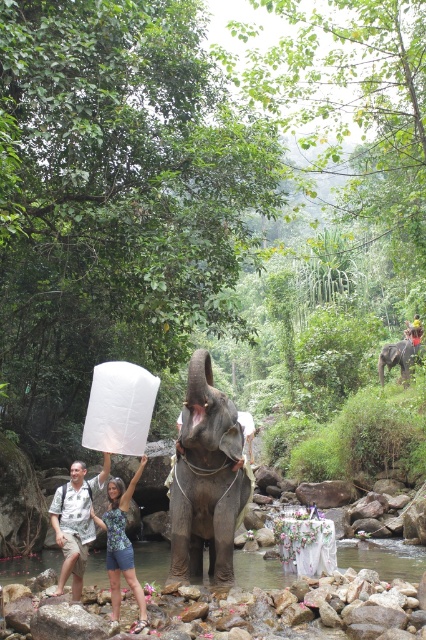
Question: Can you confirm if gray textured elephant at center is positioned above blue printed tank top at center?

Choices:
 (A) no
 (B) yes

Answer: (B)

Question: Which is nearer to the gray matte elephant at center?

Choices:
 (A) gray textured elephant at center
 (B) blue printed tank top at center

Answer: (A)

Question: Is clear water at river center further to the viewer compared to blue printed tank top at center?

Choices:
 (A) no
 (B) yes

Answer: (B)

Question: Which of the following is the farthest from the observer?

Choices:
 (A) gray matte elephant at center
 (B) blue printed tank top at center
 (C) clear water at river center
 (D) gray textured elephant at center

Answer: (A)

Question: Can you confirm if gray textured elephant at center is wider than printed cotton shirt at center?

Choices:
 (A) no
 (B) yes

Answer: (B)

Question: Considering the real-world distances, which object is closest to the printed cotton shirt at center?

Choices:
 (A) clear water at river center
 (B) gray textured elephant at center
 (C) blue printed tank top at center

Answer: (C)